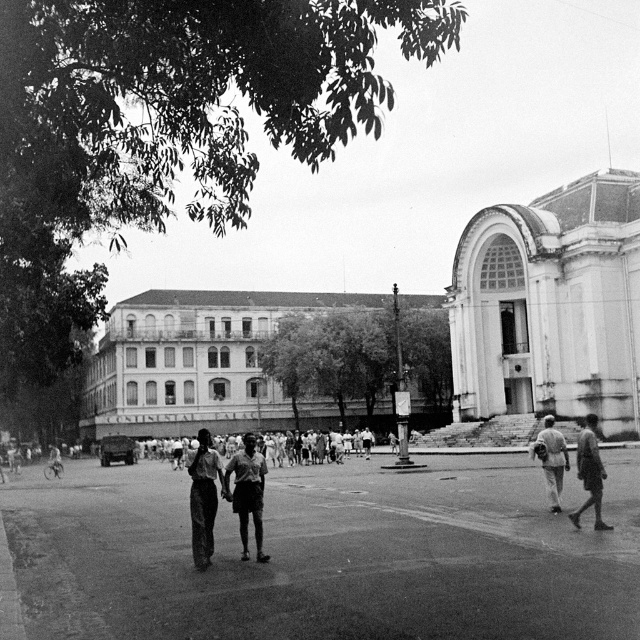
Who is more distant from viewer, (216,456) or (552,465)?

The point (552,465) is behind.

Can you confirm if dark gray pants at center is bigger than light gray fabric pants at lower right?

Correct, dark gray pants at center is larger in size than light gray fabric pants at lower right.

What do you see at coordinates (204, 497) in the screenshot? The image size is (640, 640). I see `dark gray pants at center` at bounding box center [204, 497].

Locate an element on the screen. This screenshot has height=640, width=640. dark gray pants at center is located at coordinates (204, 497).

Is dark skin textured shorts at center smaller than dark skin human at center?

No.

Consider the image. Between dark skin textured shorts at center and dark skin human at center, which one is positioned higher?

dark skin human at center is higher up.

Between point (250, 445) and point (596, 465), which one is positioned in front?

Point (250, 445) is more forward.

You are a GUI agent. You are given a task and a screenshot of the screen. Output one action in this format:
    pyautogui.click(x=<x>, y=<y>)
    Task: Click on the dark skin textured shorts at center
    
    Given the screenshot: What is the action you would take?
    pyautogui.click(x=248, y=492)

Between point (612, 625) and point (208, 452), which one is positioned in front?

Point (612, 625)

Is smooth asphalt plaza at center to the right of dark gray pants at center from the viewer's perspective?

Indeed, smooth asphalt plaza at center is positioned on the right side of dark gray pants at center.

Is point (371, 556) behind point (202, 532)?

Yes, it is.

At what (x,y) coordinates should I click in order to perform the action: click on smooth asphalt plaza at center. Please return your answer as a coordinate pair (x, y). This screenshot has width=640, height=640. Looking at the image, I should click on (324, 556).